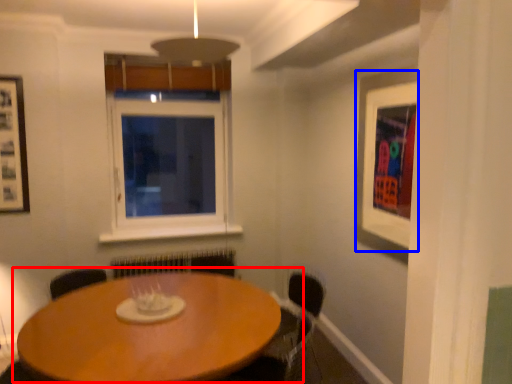
Question: Which of the following is the farthest to the observer, table (highlighted by a red box) or picture frame (highlighted by a blue box)?

Choices:
 (A) table
 (B) picture frame

Answer: (B)